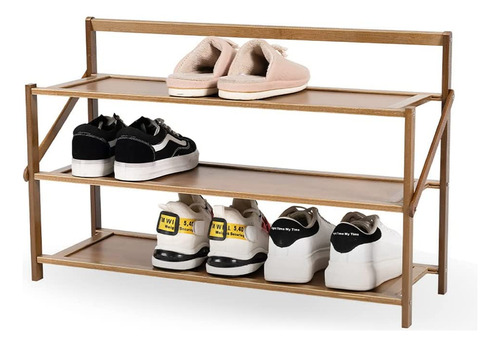
This screenshot has width=500, height=346. What are the coordinates of `shoes on bottom shelf` in the screenshot? It's located at (353, 261), (290, 253), (237, 247), (182, 238).